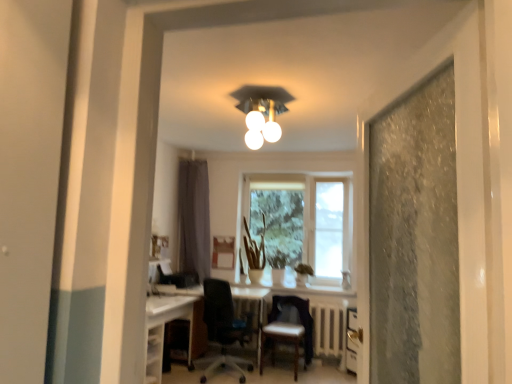
Question: Is there a large distance between white glossy computer desk at lower left and leather-like brown chair at center, the first chair positioned from the right?

Choices:
 (A) no
 (B) yes

Answer: (B)

Question: Considering the relative sizes of white glossy computer desk at lower left and leather-like brown chair at center, which is the 2th chair in left-to-right order, in the image provided, is white glossy computer desk at lower left thinner than leather-like brown chair at center, which is the 2th chair in left-to-right order,?

Choices:
 (A) no
 (B) yes

Answer: (A)

Question: Is white glossy computer desk at lower left to the right of leather-like brown chair at center, which is the 2th chair in left-to-right order, from the viewer's perspective?

Choices:
 (A) no
 (B) yes

Answer: (A)

Question: From the image's perspective, is white glossy computer desk at lower left below leather-like brown chair at center, which is the 2th chair in left-to-right order?

Choices:
 (A) yes
 (B) no

Answer: (A)

Question: Is white glossy computer desk at lower left turned away from leather-like brown chair at center, the first chair positioned from the right?

Choices:
 (A) yes
 (B) no

Answer: (B)

Question: Considering the positions of gray fabric curtain at center and black mesh office chair at center, which ranks as the first chair in left-to-right order, in the image, is gray fabric curtain at center taller or shorter than black mesh office chair at center, which ranks as the first chair in left-to-right order,?

Choices:
 (A) tall
 (B) short

Answer: (A)

Question: Is gray fabric curtain at center inside the boundaries of black mesh office chair at center, which ranks as the first chair in left-to-right order, or outside?

Choices:
 (A) inside
 (B) outside

Answer: (B)

Question: From a real-world perspective, is gray fabric curtain at center above or below black mesh office chair at center, the 2th chair viewed from the right?

Choices:
 (A) above
 (B) below

Answer: (A)

Question: Looking at the image, does gray fabric curtain at center seem bigger or smaller compared to black mesh office chair at center, the 2th chair viewed from the right?

Choices:
 (A) big
 (B) small

Answer: (B)

Question: From the image's perspective, is black mesh office chair at center, which ranks as the first chair in left-to-right order, positioned above or below white glossy computer desk at lower left?

Choices:
 (A) below
 (B) above

Answer: (B)

Question: Looking at their shapes, would you say black mesh office chair at center, which ranks as the first chair in left-to-right order, is wider or thinner than white glossy computer desk at lower left?

Choices:
 (A) wide
 (B) thin

Answer: (A)

Question: From a real-world perspective, is black mesh office chair at center, which ranks as the first chair in left-to-right order, above or below white glossy computer desk at lower left?

Choices:
 (A) above
 (B) below

Answer: (A)

Question: Is black mesh office chair at center, which ranks as the first chair in left-to-right order, taller or shorter than white glossy computer desk at lower left?

Choices:
 (A) short
 (B) tall

Answer: (B)

Question: Do you think white glossy computer desk at lower left is within black mesh office chair at center, which ranks as the first chair in left-to-right order, or outside of it?

Choices:
 (A) outside
 (B) inside

Answer: (A)

Question: From a real-world perspective, is white glossy computer desk at lower left above or below black mesh office chair at center, the 2th chair viewed from the right?

Choices:
 (A) below
 (B) above

Answer: (A)